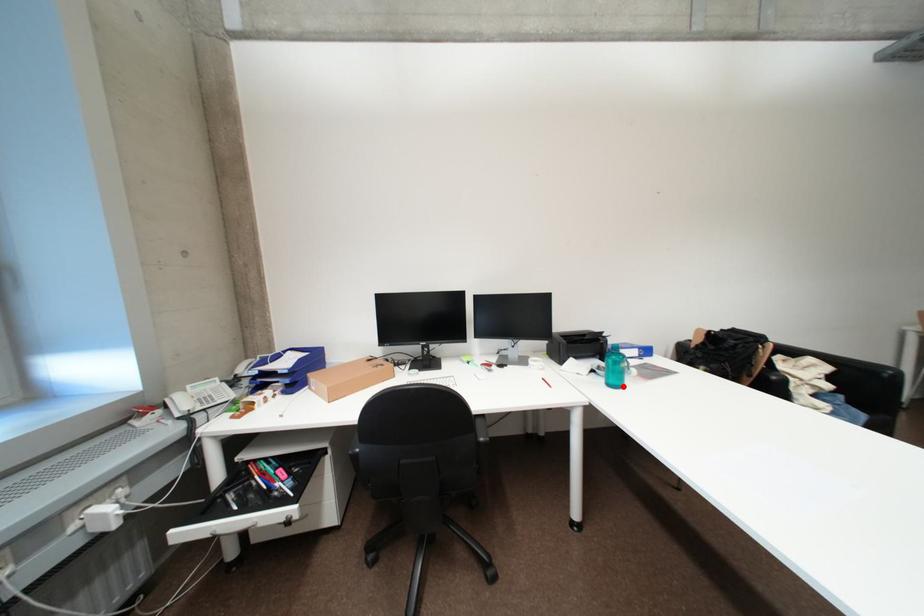
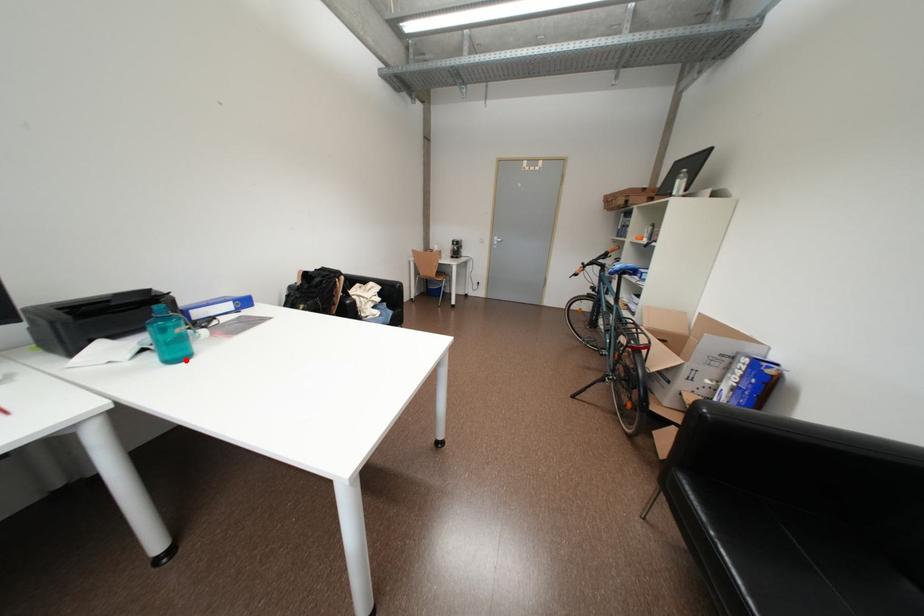
I am providing you with two images of the same scene from different viewpoints. A red point is marked on the first image and another point is marked on the second image. Are the points marked in image1 and image2 representing the same 3D position?

Yes